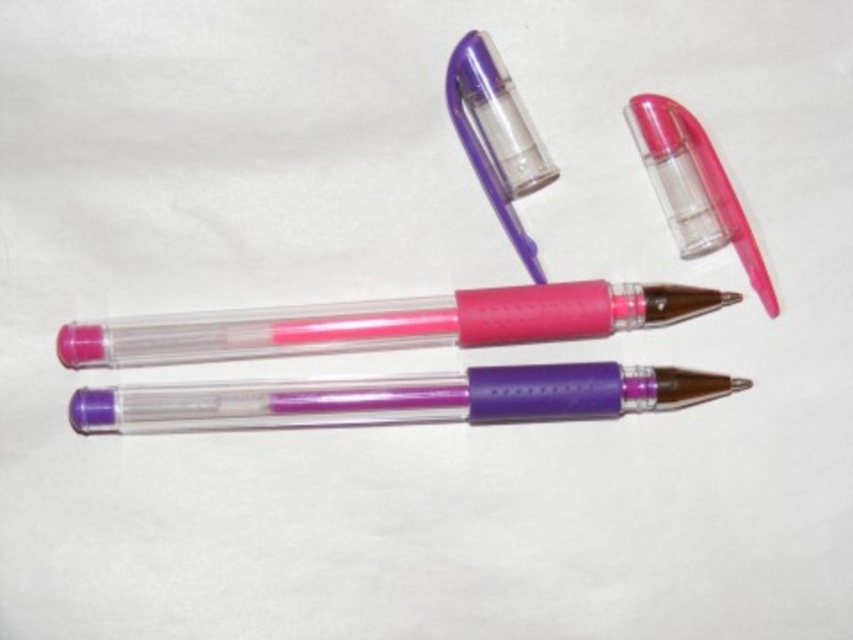
Is pink translucent pen at center to the right of purple translucent pen at center from the viewer's perspective?

No, pink translucent pen at center is not to the right of purple translucent pen at center.

Is point (173, 326) in front of point (184, 384)?

Yes, it is in front of point (184, 384).

What do you see at coordinates (387, 323) in the screenshot?
I see `pink translucent pen at center` at bounding box center [387, 323].

At what (x,y) coordinates should I click in order to perform the action: click on pink translucent pen at center. Please return your answer as a coordinate pair (x, y). Looking at the image, I should click on (387, 323).

What do you see at coordinates (387, 323) in the screenshot? I see `pink translucent pen at center` at bounding box center [387, 323].

Who is higher up, pink translucent pen at center or pink translucent lipstick at upper right?

Positioned higher is pink translucent lipstick at upper right.

Who is more forward, [132,332] or [718,205]?

Point [132,332] is in front.

The image size is (853, 640). I want to click on pink translucent pen at center, so click(387, 323).

Who is more distant from viewer, (x=316, y=420) or (x=701, y=147)?

The point (x=316, y=420) is behind.

I want to click on purple translucent pen at center, so click(x=399, y=397).